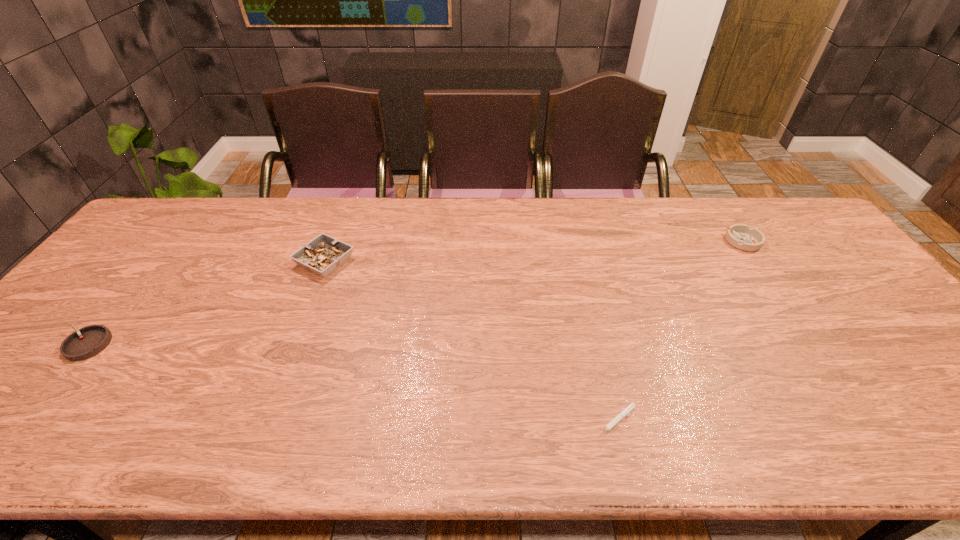
Where is `the third closest object to the leftmost object`? The height and width of the screenshot is (540, 960). the third closest object to the leftmost object is located at coordinates (741, 236).

Locate an element on the screen. Image resolution: width=960 pixels, height=540 pixels. the third closest object relative to the leftmost ashtray is located at coordinates (741, 236).

The width and height of the screenshot is (960, 540). I want to click on the closest ashtray to the second ashtray from left to right, so click(89, 341).

The width and height of the screenshot is (960, 540). Find the location of `the closest ashtray to the rightmost object`. the closest ashtray to the rightmost object is located at coordinates (322, 255).

At what (x,y) coordinates should I click in order to perform the action: click on vacant space that satisfies the following two spatial constraints: 1. on the back side of the second nearest object; 2. on the left side of the second ashtray from left to right. Please return your answer as a coordinate pair (x, y). The height and width of the screenshot is (540, 960). Looking at the image, I should click on (154, 261).

Find the location of `free space that satisfies the following two spatial constraints: 1. on the front side of the syringe; 2. on the right side of the leftmost ashtray`. free space that satisfies the following two spatial constraints: 1. on the front side of the syringe; 2. on the right side of the leftmost ashtray is located at coordinates (27, 422).